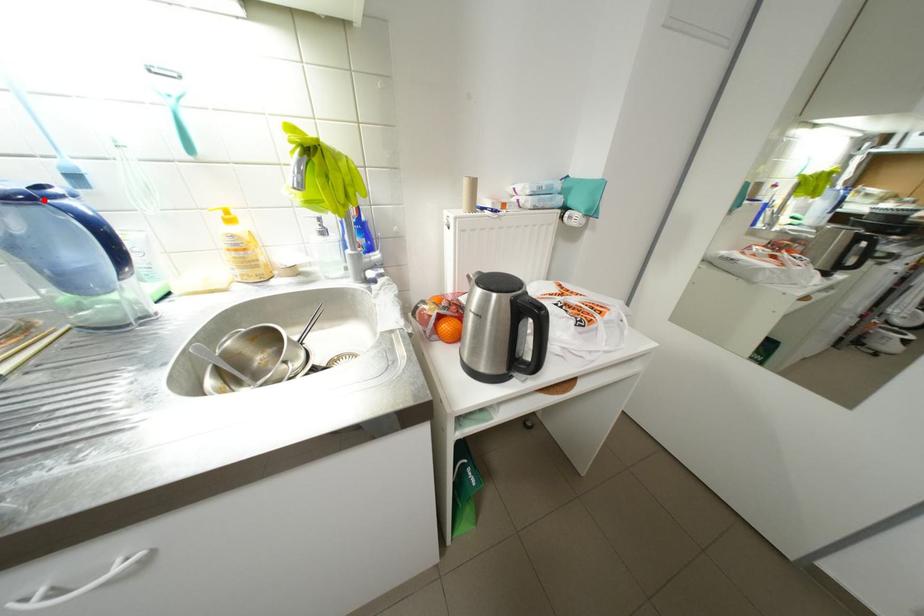
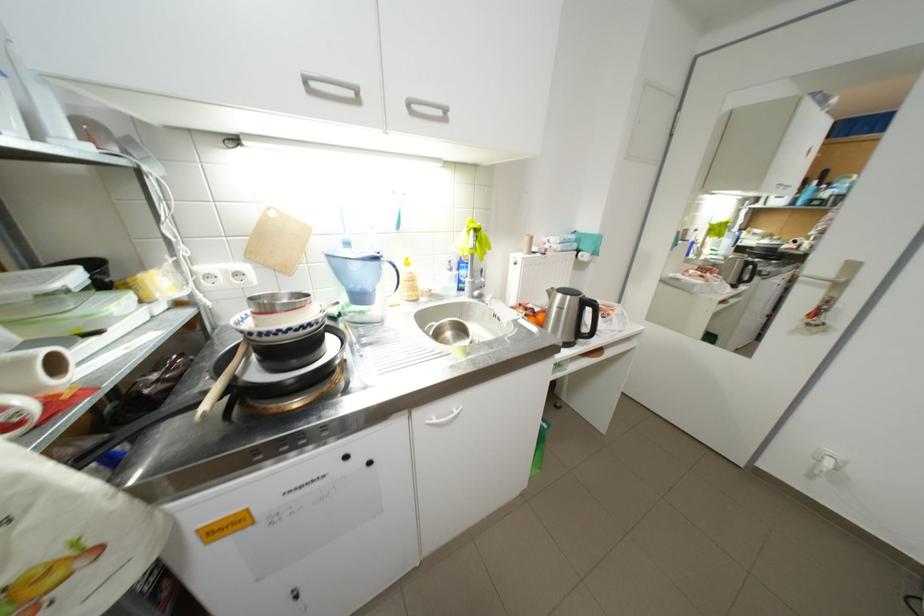
Question: I am providing you with two images of the same scene from different viewpoints. Given a red point in image1, look at the same physical point in image2. Is it:

Choices:
 (A) Closer to the viewpoint
 (B) Farther from the viewpoint

Answer: (A)